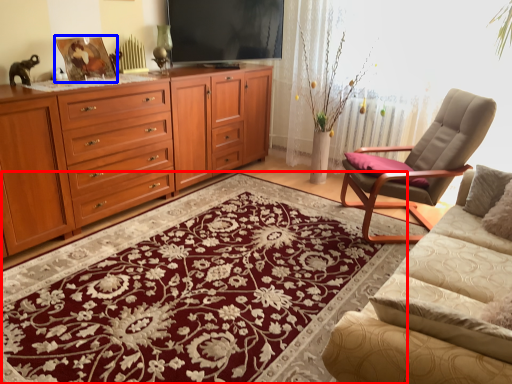
Question: Which object appears closest to the camera in this image, mat (highlighted by a red box) or picture frame (highlighted by a blue box)?

Choices:
 (A) mat
 (B) picture frame

Answer: (A)